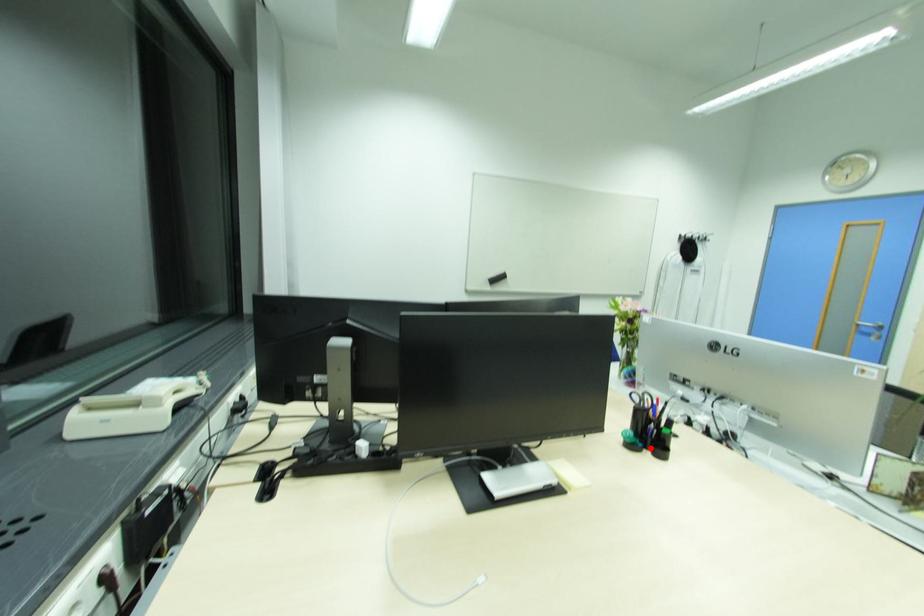
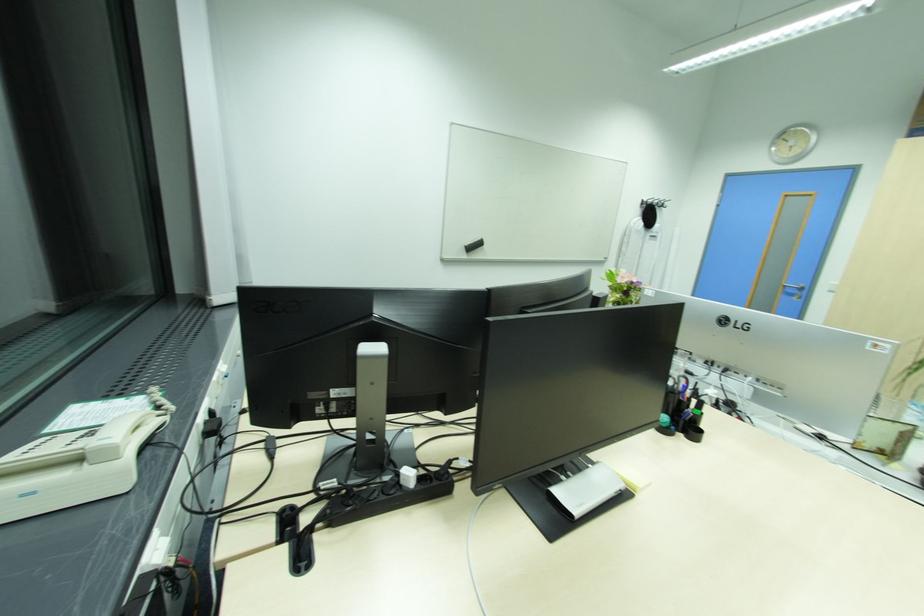
In the second image, find the point that corresponds to the highlighted location in the first image.

(683, 430)